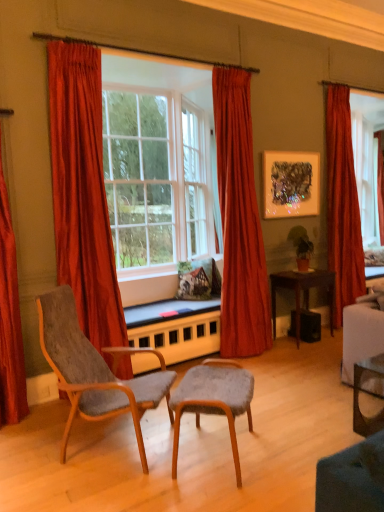
You are a GUI agent. You are given a task and a screenshot of the screen. Output one action in this format:
    pyautogui.click(x=<x>, y=<y>)
    Task: Click on the vacant area that is situated to the right of velvet red curtain at center, arranged as the third curtain when viewed from the left
    
    Given the screenshot: What is the action you would take?
    pyautogui.click(x=286, y=354)